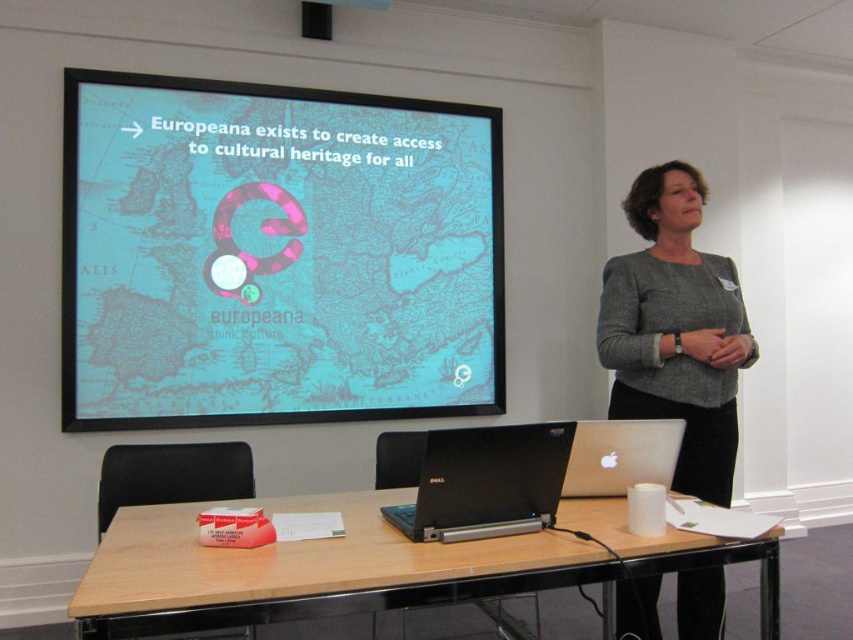
Between point (77, 234) and point (370, 8), which one is positioned behind?

Point (77, 234)

Looking at this image, can you confirm if teal matte/blackboard at upper left is shorter than black plastic projector at upper center?

No, teal matte/blackboard at upper left is not shorter than black plastic projector at upper center.

Identify the location of teal matte/blackboard at upper left. Image resolution: width=853 pixels, height=640 pixels. tap(276, 253).

Can you confirm if wooden table at lower center is smaller than gray sweater at upper right?

Indeed, wooden table at lower center has a smaller size compared to gray sweater at upper right.

Does wooden table at lower center have a greater height compared to gray sweater at upper right?

In fact, wooden table at lower center may be shorter than gray sweater at upper right.

Where is `wooden table at lower center`? wooden table at lower center is located at coordinates (370, 566).

Does wooden table at lower center have a smaller size compared to black matte laptop at center?

Incorrect, wooden table at lower center is not smaller in size than black matte laptop at center.

Does wooden table at lower center come behind black matte laptop at center?

No, wooden table at lower center is closer to the viewer.

You are a GUI agent. You are given a task and a screenshot of the screen. Output one action in this format:
    pyautogui.click(x=<x>, y=<y>)
    Task: Click on the wooden table at lower center
    
    Given the screenshot: What is the action you would take?
    pyautogui.click(x=370, y=566)

The height and width of the screenshot is (640, 853). I want to click on wooden table at lower center, so click(370, 566).